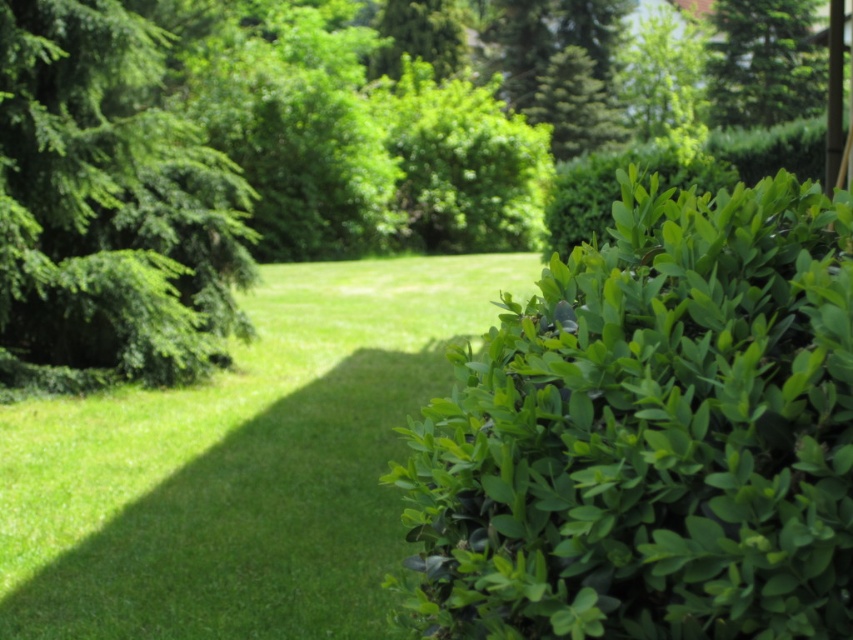
You are standing in the garden and want to place a small statue between the green leafy bush at right and the green leafy bush at upper center. Based on their positions, which direction should you move from the upper center bush to reach the area between them?

You should move to the right from the green leafy bush at upper center to reach the area between the green leafy bush at upper center and the green leafy bush at right since the green leafy bush at right is located to the right of the green leafy bush at upper center.

You are standing in the garden and want to place a 2.5 meter long bench between the green leafy tree at left and the green leafy bush at upper center. Can the bench fit in the space between them?

The distance between the green leafy tree at left and the green leafy bush at upper center is 25.45 meters. Since the bench is only 2.5 meters long, there is more than enough space to place it between them.